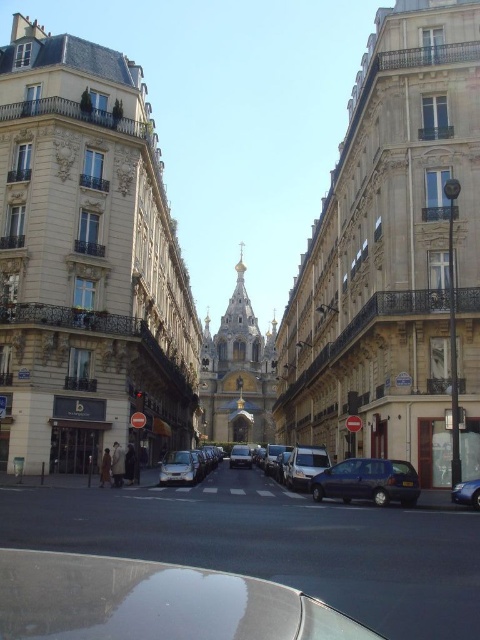
Question: Is metallic silver van at center smaller than silver metallic van at center?

Choices:
 (A) yes
 (B) no

Answer: (A)

Question: Based on their relative distances, which object is nearer to the dark blue metallic car at center?

Choices:
 (A) satin silver car at center
 (B) metallic silver van at center
 (C) metallic blue car at center

Answer: (B)

Question: Which object is positioned closest to the satin silver car at center?

Choices:
 (A) metallic blue car at center
 (B) metallic silver van at center

Answer: (B)

Question: Can you confirm if satin silver car at center is positioned to the right of silver metallic van at center?

Choices:
 (A) yes
 (B) no

Answer: (B)

Question: Does dark blue metallic car at center appear over silver metallic van at center?

Choices:
 (A) yes
 (B) no

Answer: (A)

Question: Which of the following is the farthest from the observer?

Choices:
 (A) (175, 461)
 (B) (232, 451)

Answer: (B)